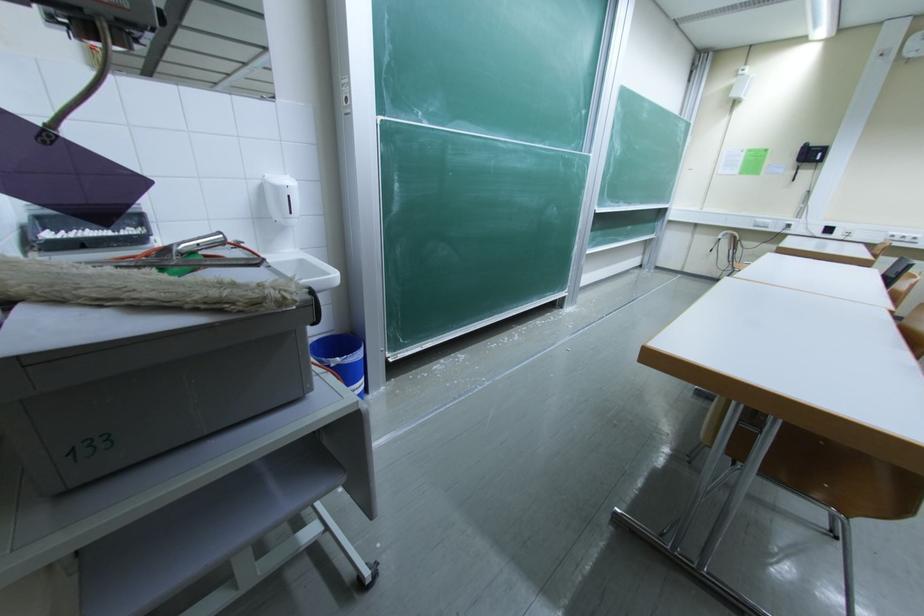
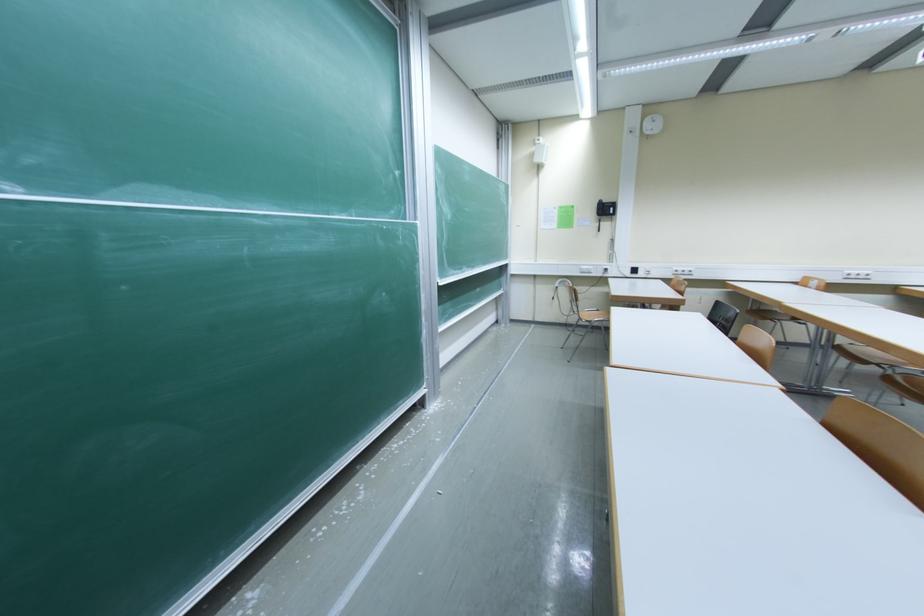
Question: The camera is either moving clockwise (left) or counter-clockwise (right) around the object. The first image is from the beginning of the video and the second image is from the end. Is the camera moving left or right when shooting the video?

Choices:
 (A) Left
 (B) Right

Answer: (A)